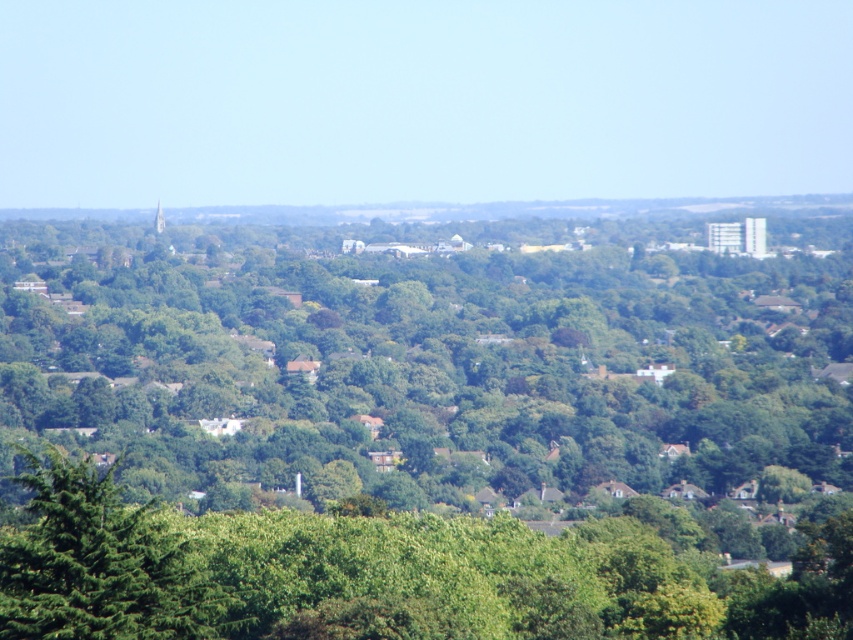
You are standing at the camera position and want to reach the point marked at coordinates point (297,285). If you walk straight towards it, how far will you have to walk?

You will have to walk 2151.84 feet to reach the point marked at coordinates point (297,285) from the camera position.

You are standing at the point labeled as point (422, 365) in the image. What object is directly beneath your feet?

The point (422, 365) corresponds to the green leafy tree at center, so the object directly beneath your feet is the green leafy tree at center.

Consider the image. You are a bird flying over the landscape and want to land on one of the green leafy trees. Which tree is located to the right of the other? The green leafy tree at center or the green leafy tree at lower left?

The green leafy tree at center is positioned on the right side of green leafy tree at lower left, so the tree at center is to the right of the one at lower left.